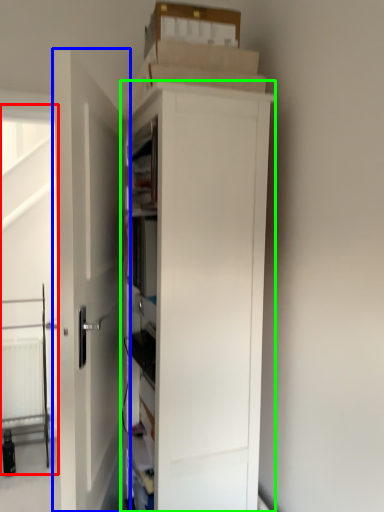
Question: Which object is positioned closest to screen door (highlighted by a red box)? Select from door (highlighted by a blue box) and cupboard (highlighted by a green box).

Choices:
 (A) door
 (B) cupboard

Answer: (A)